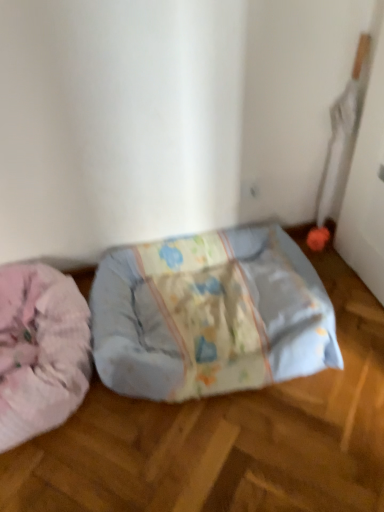
Question: Considering the relative sizes of fluffy pink dog bed at left and light blue fabric pet bed at center in the image provided, is fluffy pink dog bed at left thinner than light blue fabric pet bed at center?

Choices:
 (A) no
 (B) yes

Answer: (A)

Question: From a real-world perspective, is fluffy pink dog bed at left under light blue fabric pet bed at center?

Choices:
 (A) yes
 (B) no

Answer: (B)

Question: Is the position of fluffy pink dog bed at left less distant than that of light blue fabric pet bed at center?

Choices:
 (A) no
 (B) yes

Answer: (B)

Question: From a real-world perspective, is fluffy pink dog bed at left over light blue fabric pet bed at center?

Choices:
 (A) yes
 (B) no

Answer: (A)

Question: Does fluffy pink dog bed at left have a lesser height compared to light blue fabric pet bed at center?

Choices:
 (A) yes
 (B) no

Answer: (A)

Question: Is fluffy pink dog bed at left not inside light blue fabric pet bed at center?

Choices:
 (A) no
 (B) yes

Answer: (B)

Question: Is light blue fabric pet bed at center to the right of fluffy pink dog bed at left from the viewer's perspective?

Choices:
 (A) yes
 (B) no

Answer: (A)

Question: From a real-world perspective, is light blue fabric pet bed at center over fluffy pink dog bed at left?

Choices:
 (A) yes
 (B) no

Answer: (B)

Question: Does light blue fabric pet bed at center lie behind fluffy pink dog bed at left?

Choices:
 (A) no
 (B) yes

Answer: (B)

Question: Can you confirm if light blue fabric pet bed at center is bigger than fluffy pink dog bed at left?

Choices:
 (A) yes
 (B) no

Answer: (A)

Question: Does light blue fabric pet bed at center have a lesser width compared to fluffy pink dog bed at left?

Choices:
 (A) no
 (B) yes

Answer: (B)

Question: From the image's perspective, is light blue fabric pet bed at center beneath fluffy pink dog bed at left?

Choices:
 (A) yes
 (B) no

Answer: (B)

Question: From a real-world perspective, relative to fluffy pink dog bed at left, is light blue fabric pet bed at center vertically above or below?

Choices:
 (A) below
 (B) above

Answer: (A)